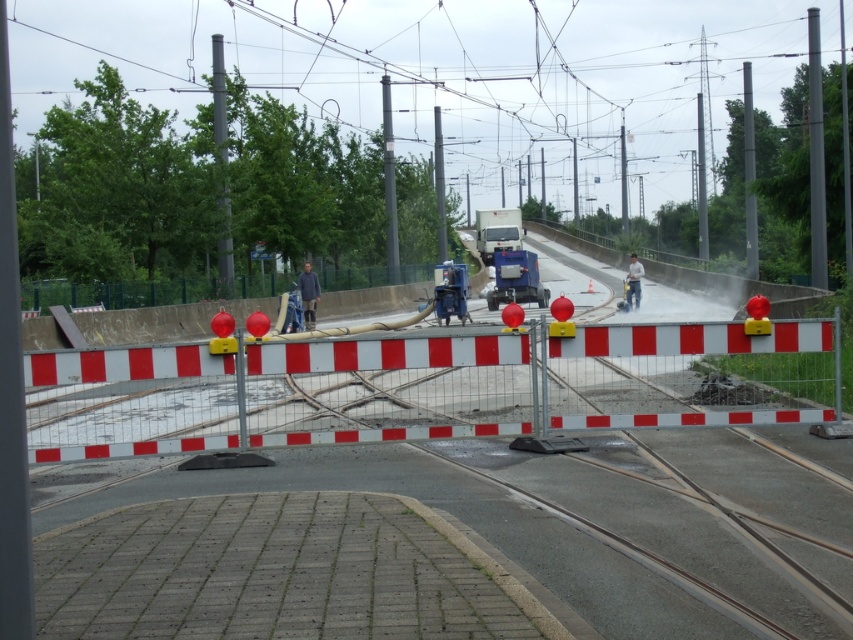
Which is in front, point (700, 365) or point (447, 314)?

Positioned in front is point (700, 365).

Is point (76, 356) closer to camera compared to point (453, 305)?

Yes, point (76, 356) is closer to viewer.

Where is `metallic silver barricade at center`? metallic silver barricade at center is located at coordinates (538, 381).